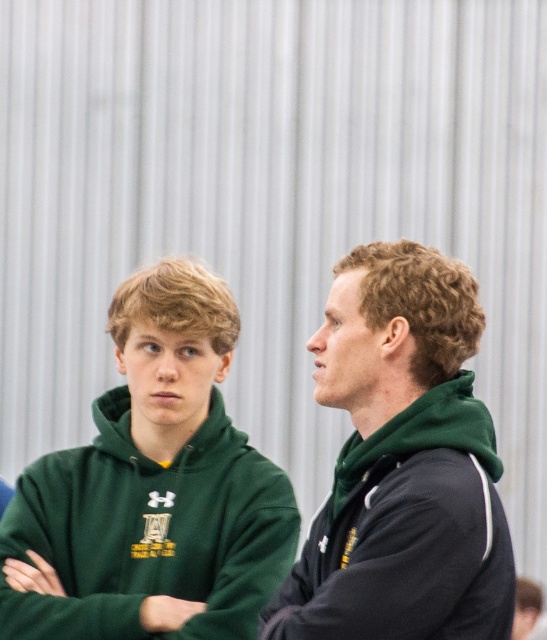
Can you confirm if green fleece hoodie at left is positioned below green matte hoodie at center?

No, green fleece hoodie at left is not below green matte hoodie at center.

Does green fleece hoodie at left lie behind green matte hoodie at center?

Yes, it is.

Who is more distant from viewer, (14, 602) or (474, 520)?

Point (14, 602)

Find the location of `green fleece hoodie at left`. green fleece hoodie at left is located at coordinates (155, 486).